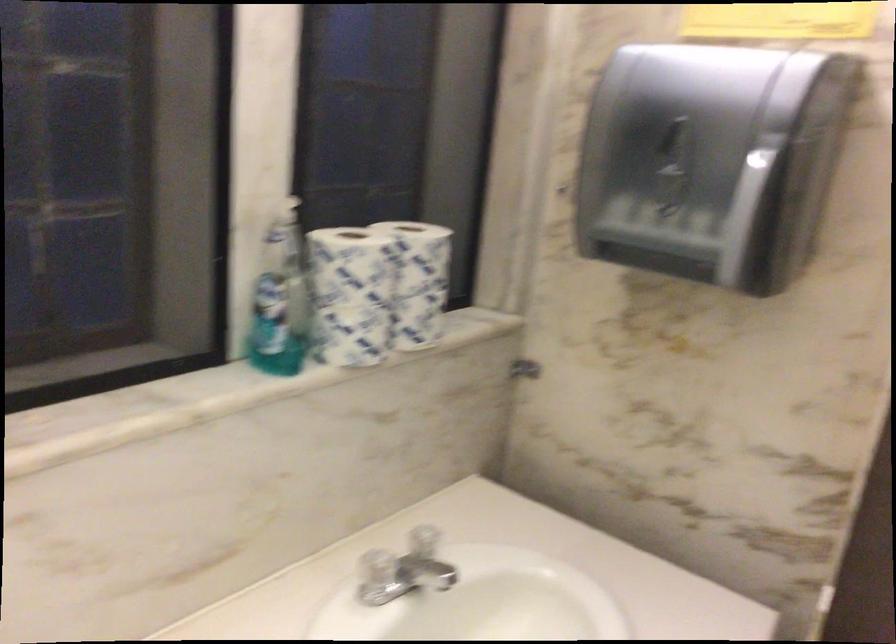
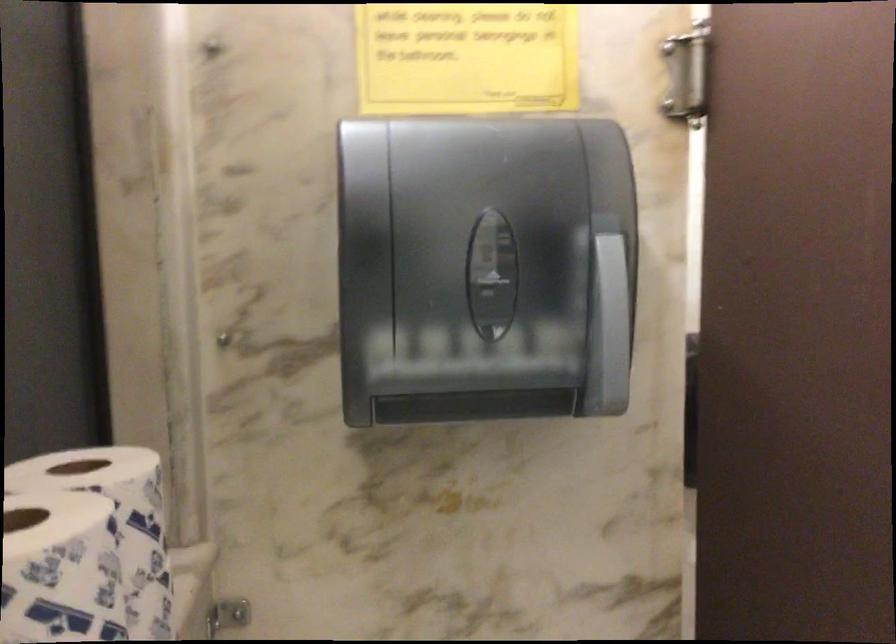
Locate, in the second image, the point that corresponds to [392,257] in the first image.

(117, 522)